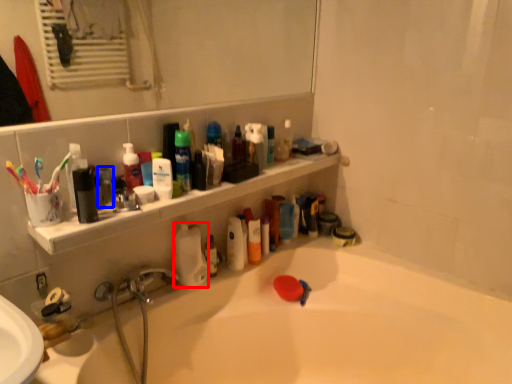
Question: Among these objects, which one is farthest to the camera, cleaning product (highlighted by a red box) or mouthwash (highlighted by a blue box)?

Choices:
 (A) cleaning product
 (B) mouthwash

Answer: (A)